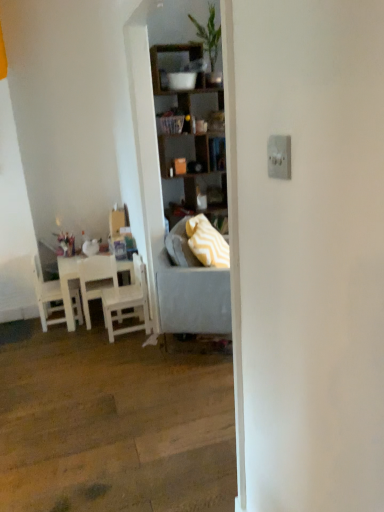
Image resolution: width=384 pixels, height=512 pixels. I want to click on free spot in front of white wood chair at left, which is counted as the 3th chair, starting from the left, so click(x=113, y=349).